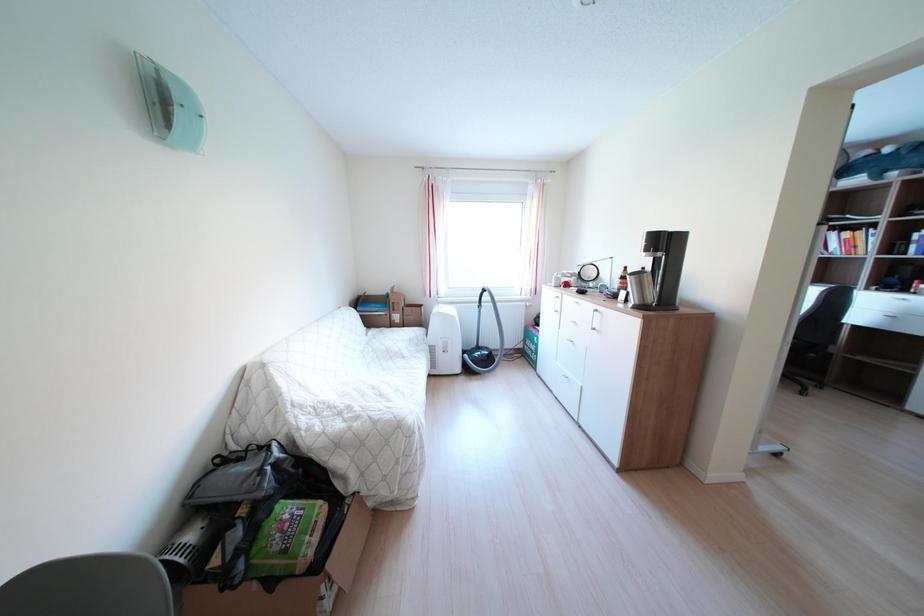
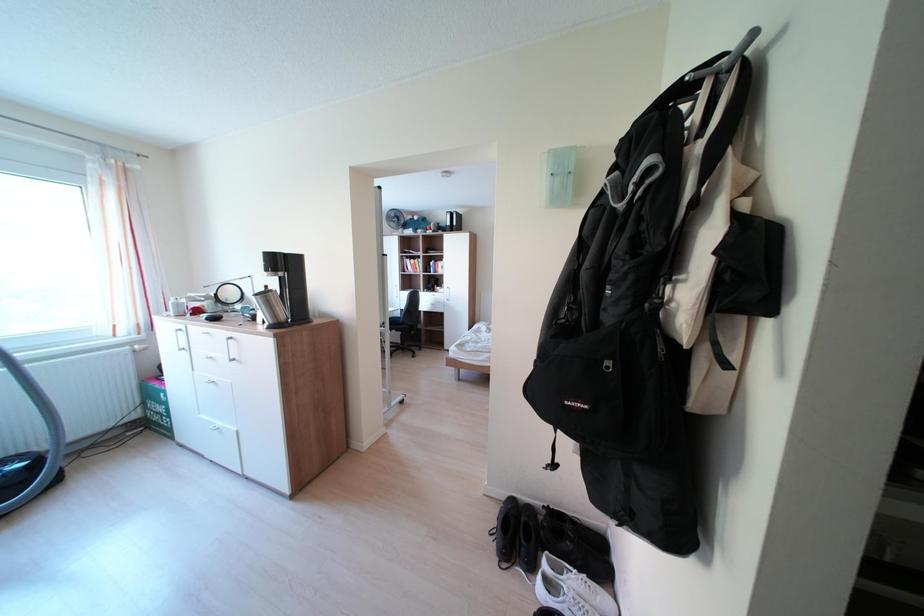
Question: The camera is either moving clockwise (left) or counter-clockwise (right) around the object. The first image is from the beginning of the video and the second image is from the end. Is the camera moving left or right when shooting the video?

Choices:
 (A) Left
 (B) Right

Answer: (A)